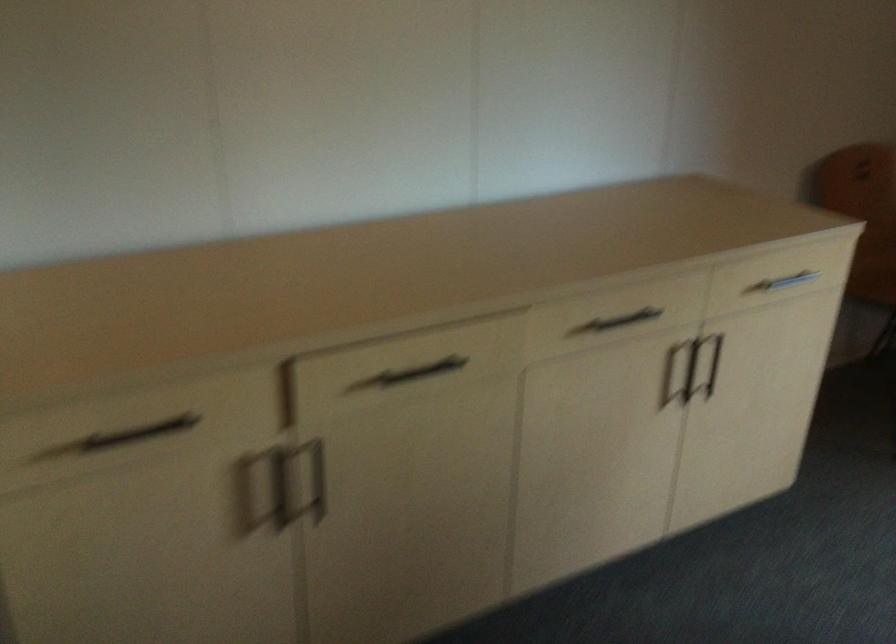
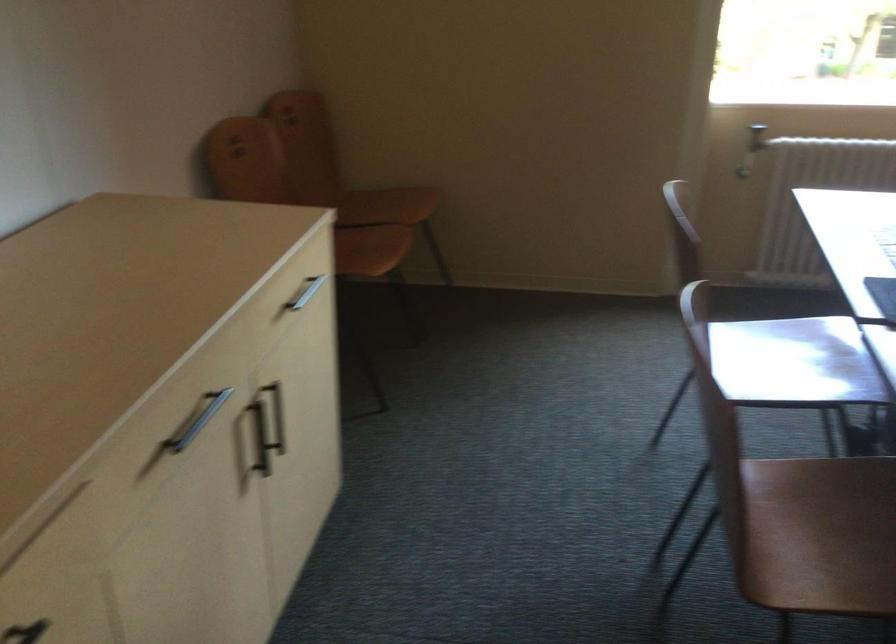
Where in the second image is the point corresponding to (x=727, y=371) from the first image?

(277, 415)